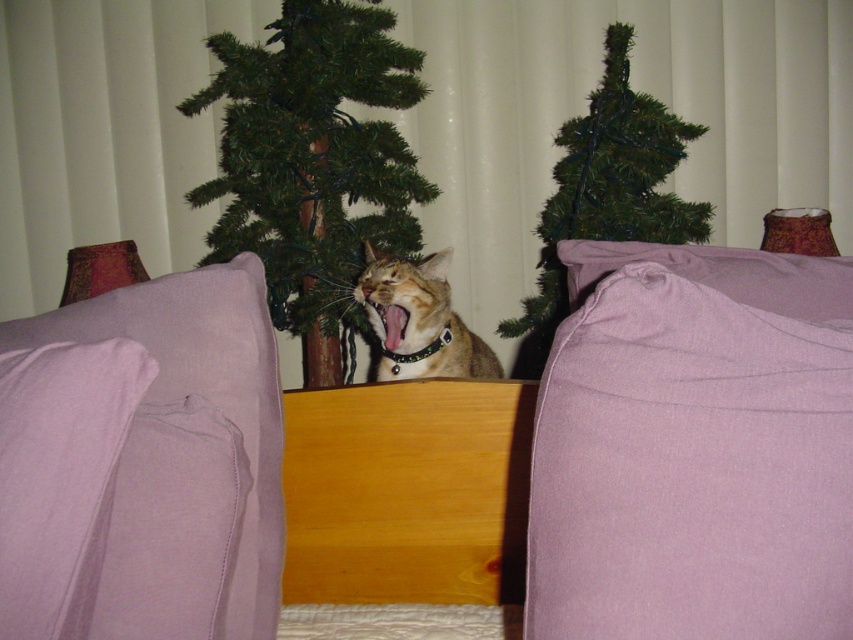
You are a cat owner who wants to place a small toy between the lavender cotton blanket at lower right and the lavender fleece pillow at lower left. Can you fit the toy there if it requires 14 inches of space?

The lavender cotton blanket at lower right and lavender fleece pillow at lower left are 13.79 inches apart. Since the required space for the toy is 14 inches, which is slightly larger than the available space, the toy cannot be placed there.

You are organizing a small gift wrapping station for Christmas. You have a lavender cotton blanket at lower right and a lavender fleece pillow at lower left. Which item would you choose to cover a larger gift box if you want to ensure it is fully covered without needing extra material?

The lavender cotton blanket at lower right has a larger width than the lavender fleece pillow at lower left, so it would be better to use the lavender cotton blanket at lower right to cover the larger gift box since it can fully cover it without needing extra material.